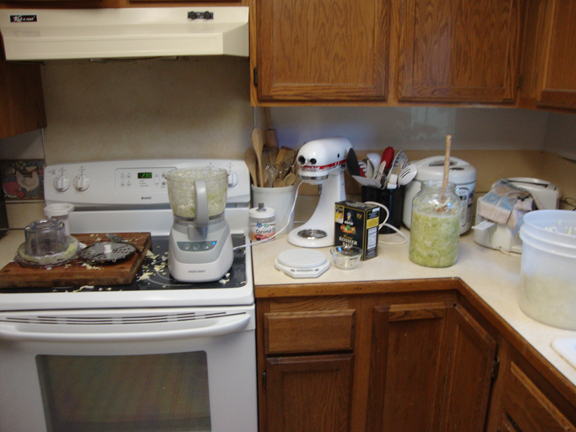
Identify the location of foo0d processor. (221, 238).